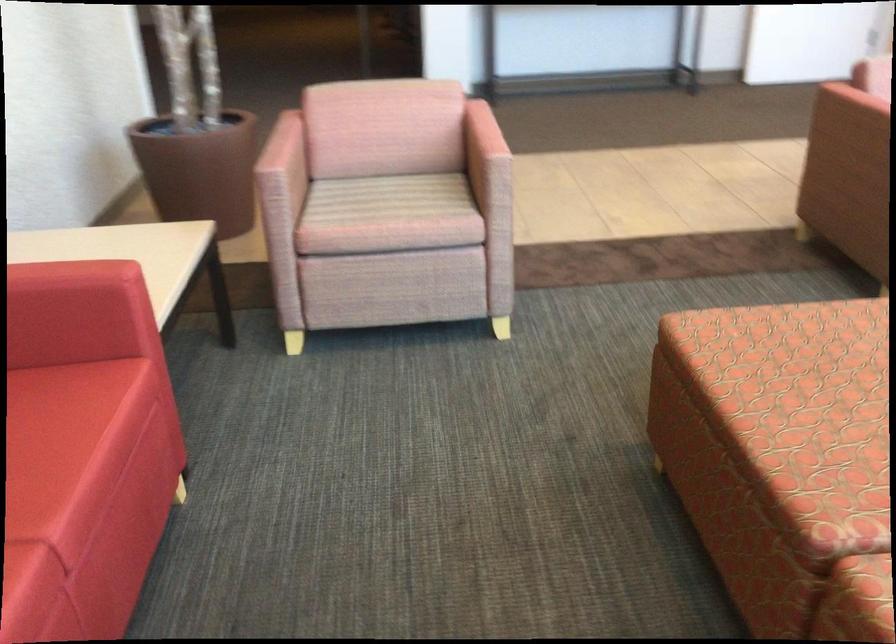
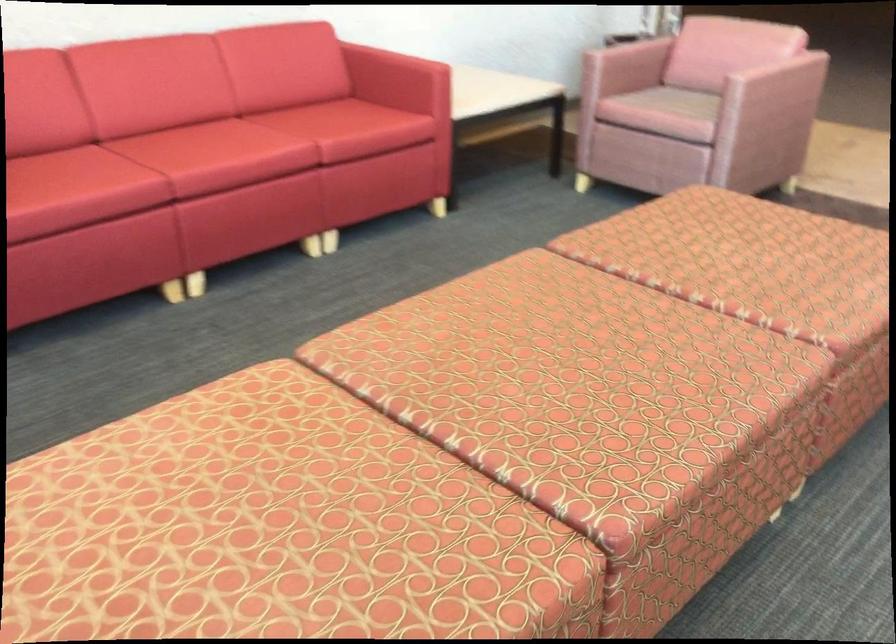
Locate, in the second image, the point that corresponds to the point at 389,196 in the first image.

(686, 102)